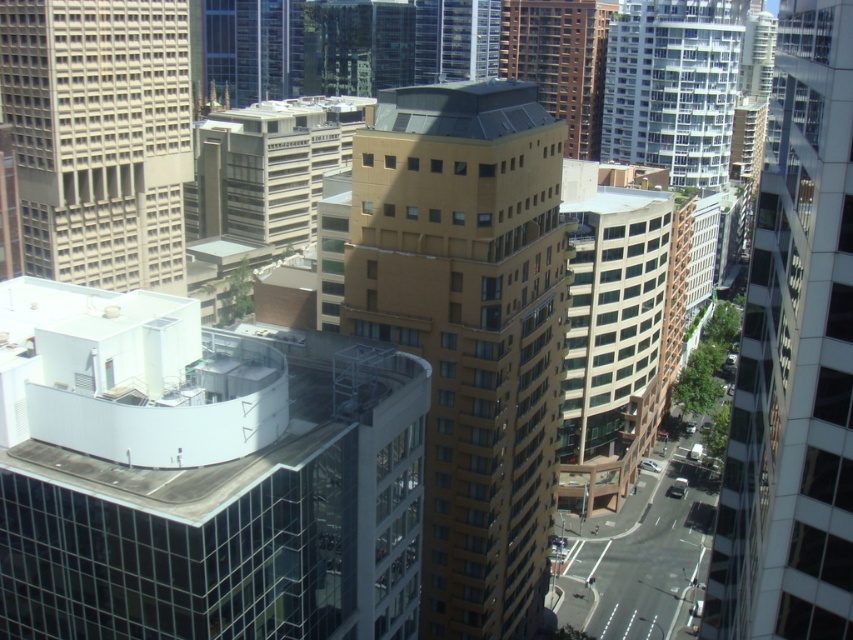
Between white glass building at upper right and brown glassy building at center, which one is positioned lower?

brown glassy building at center is lower down.

Can you confirm if white glass building at upper right is smaller than brown glassy building at center?

Yes, white glass building at upper right is smaller than brown glassy building at center.

This screenshot has height=640, width=853. Find the location of `white glass building at upper right`. white glass building at upper right is located at coordinates (672, 86).

Can you confirm if matte gold building at center is wider than brown glass building at center?

Indeed, matte gold building at center has a greater width compared to brown glass building at center.

Is matte gold building at center taller than brown glass building at center?

Yes.

Between point (560, 353) and point (848, 176), which one is positioned in front?

Positioned in front is point (848, 176).

Where is `matte gold building at center`? This screenshot has width=853, height=640. matte gold building at center is located at coordinates [x=469, y=330].

Can you confirm if brown glass building at center is positioned above brown glassy building at center?

No, brown glass building at center is not above brown glassy building at center.

Can you confirm if brown glass building at center is positioned to the left of brown glassy building at center?

Yes, brown glass building at center is to the left of brown glassy building at center.

Describe the element at coordinates (793, 358) in the screenshot. This screenshot has height=640, width=853. I see `brown glass building at center` at that location.

What are the coordinates of `brown glass building at center` in the screenshot? It's located at point(793,358).